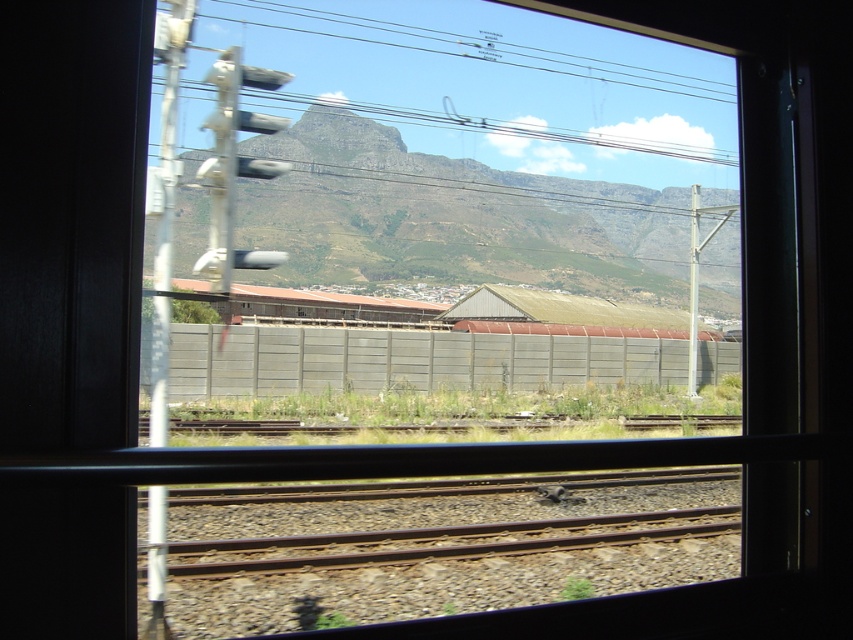
Between green grassy mountain at center and rusty metal train track at bottom, which one appears on the right side from the viewer's perspective?

rusty metal train track at bottom

At what (x,y) coordinates should I click in order to perform the action: click on green grassy mountain at center. Please return your answer as a coordinate pair (x, y). The image size is (853, 640). Looking at the image, I should click on (451, 218).

Locate an element on the screen. This screenshot has width=853, height=640. green grassy mountain at center is located at coordinates (x=451, y=218).